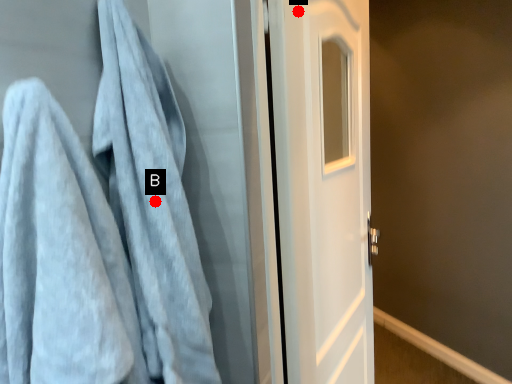
Question: Two points are circled on the image, labeled by A and B beside each circle. Which point is farther from the camera taking this photo?

Choices:
 (A) A is further
 (B) B is further

Answer: (A)